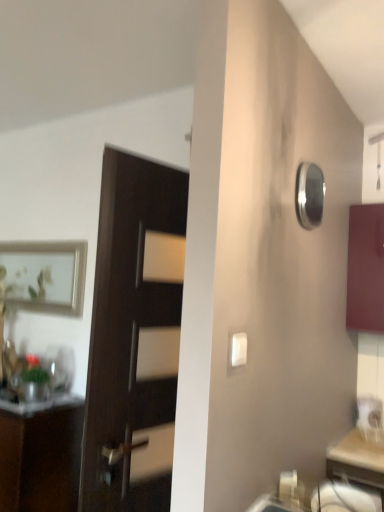
What do you see at coordinates (365, 268) in the screenshot? The height and width of the screenshot is (512, 384). I see `matte burgundy cabinet at right, which is the 2th cabinetry in bottom-to-top order` at bounding box center [365, 268].

Identify the location of white plastic light switch at center. (239, 349).

The image size is (384, 512). Identify the location of polished silver mirror at upper right. (309, 195).

At what (x,y) coordinates should I click in order to perform the action: click on dark wood door at center. Please return your answer as a coordinate pair (x, y). This screenshot has height=512, width=384. Looking at the image, I should click on (134, 336).

Between point (150, 211) and point (376, 275), which one is positioned behind?

The point (376, 275) is farther.

Is dark wood door at center looking in the opposite direction of matte burgundy cabinet at right, which appears as the 1th cabinetry when viewed from the top?

No, dark wood door at center's orientation is not away from matte burgundy cabinet at right, which appears as the 1th cabinetry when viewed from the top.

Is dark wood door at center smaller than matte burgundy cabinet at right, marked as the first cabinetry in a right-to-left arrangement?

Actually, dark wood door at center might be larger than matte burgundy cabinet at right, marked as the first cabinetry in a right-to-left arrangement.

How many degrees apart are the facing directions of matte brown cabinet at left, the first cabinetry from the left, and matte burgundy cabinet at right, which appears as the 1th cabinetry when viewed from the top?

The angle between the facing direction of matte brown cabinet at left, the first cabinetry from the left, and the facing direction of matte burgundy cabinet at right, which appears as the 1th cabinetry when viewed from the top, is 0.533 degrees.

From the image's perspective, is matte brown cabinet at left, the first cabinetry from the left, on top of matte burgundy cabinet at right, marked as the first cabinetry in a right-to-left arrangement?

No, from the image's perspective, matte brown cabinet at left, the first cabinetry from the left, is not above matte burgundy cabinet at right, marked as the first cabinetry in a right-to-left arrangement.

Could you measure the distance between matte brown cabinet at left, marked as the second cabinetry in a top-to-bottom arrangement, and matte burgundy cabinet at right, which appears as the 1th cabinetry when viewed from the top?

The distance of matte brown cabinet at left, marked as the second cabinetry in a top-to-bottom arrangement, from matte burgundy cabinet at right, which appears as the 1th cabinetry when viewed from the top, is 5.91 feet.

Considering the positions of objects matte brown cabinet at left, the first cabinetry from the left, and matte burgundy cabinet at right, the second cabinetry in the left-to-right sequence, in the image provided, who is more to the right, matte brown cabinet at left, the first cabinetry from the left, or matte burgundy cabinet at right, the second cabinetry in the left-to-right sequence,?

Positioned to the right is matte burgundy cabinet at right, the second cabinetry in the left-to-right sequence.

Is matte burgundy cabinet at right, the second cabinetry in the left-to-right sequence, at the left side of matte silver picture frame at upper left?

No.

Is matte burgundy cabinet at right, which is the 2th cabinetry in bottom-to-top order, positioned far away from matte silver picture frame at upper left?

Yes, matte burgundy cabinet at right, which is the 2th cabinetry in bottom-to-top order, is far from matte silver picture frame at upper left.

Is matte burgundy cabinet at right, which appears as the 1th cabinetry when viewed from the top, situated inside matte silver picture frame at upper left or outside?

matte burgundy cabinet at right, which appears as the 1th cabinetry when viewed from the top, is outside matte silver picture frame at upper left.

At what (x,y) coordinates should I click in order to perform the action: click on picture frame that is under the matte burgundy cabinet at right, which is the 2th cabinetry in bottom-to-top order (from a real-world perspective). Please return your answer as a coordinate pair (x, y). The width and height of the screenshot is (384, 512). Looking at the image, I should click on (45, 275).

Is matte silver picture frame at upper left thinner than polished silver mirror at upper right?

Indeed, matte silver picture frame at upper left has a lesser width compared to polished silver mirror at upper right.

Does matte silver picture frame at upper left appear on the right side of polished silver mirror at upper right?

No.

Does matte silver picture frame at upper left have a lesser height compared to polished silver mirror at upper right?

Incorrect, the height of matte silver picture frame at upper left does not fall short of that of polished silver mirror at upper right.

Considering the sizes of white plastic light switch at center and polished silver mirror at upper right in the image, is white plastic light switch at center taller or shorter than polished silver mirror at upper right?

Clearly, white plastic light switch at center is shorter compared to polished silver mirror at upper right.

Between white plastic light switch at center and polished silver mirror at upper right, which one is positioned in front?

white plastic light switch at center is in front.

From the image's perspective, is white plastic light switch at center below polished silver mirror at upper right?

Yes, from the image's perspective, white plastic light switch at center is beneath polished silver mirror at upper right.

Which object is closer to the camera taking this photo, matte silver picture frame at upper left or matte brown cabinet at left, marked as the second cabinetry in a top-to-bottom arrangement?

Positioned in front is matte brown cabinet at left, marked as the second cabinetry in a top-to-bottom arrangement.

Is matte silver picture frame at upper left with matte brown cabinet at left, marked as the second cabinetry in a top-to-bottom arrangement?

No, matte silver picture frame at upper left is not touching matte brown cabinet at left, marked as the second cabinetry in a top-to-bottom arrangement.

Between matte silver picture frame at upper left and matte brown cabinet at left, marked as the second cabinetry in a top-to-bottom arrangement, which one has larger size?

matte brown cabinet at left, marked as the second cabinetry in a top-to-bottom arrangement.

How different are the orientations of matte silver picture frame at upper left and matte brown cabinet at left, the first cabinetry from the left, in degrees?

The facing directions of matte silver picture frame at upper left and matte brown cabinet at left, the first cabinetry from the left, are 0.939 degrees apart.

Is point (237, 337) behind point (63, 452)?

No, it is in front of (63, 452).

Starting from the white plastic light switch at center, which cabinetry is the 1st one behind? Please provide its 2D coordinates.

[(41, 458)]

Does white plastic light switch at center turn towards matte brown cabinet at left, the first cabinetry from the left?

No, white plastic light switch at center is not oriented towards matte brown cabinet at left, the first cabinetry from the left.

Is white plastic light switch at center wider than matte brown cabinet at left, marked as the second cabinetry in a top-to-bottom arrangement?

In fact, white plastic light switch at center might be narrower than matte brown cabinet at left, marked as the second cabinetry in a top-to-bottom arrangement.

Image resolution: width=384 pixels, height=512 pixels. What are the coordinates of `cabinetry on the right of dark wood door at center` in the screenshot? It's located at (365, 268).

Image resolution: width=384 pixels, height=512 pixels. In order to click on cabinetry below the matte burgundy cabinet at right, marked as the first cabinetry in a right-to-left arrangement (from a real-world perspective) in this screenshot , I will do `click(41, 458)`.

When comparing their distances from dark wood door at center, does matte brown cabinet at left, positioned as the 1th cabinetry in bottom-to-top order, or matte white drawer at lower right seem further?

matte white drawer at lower right lies further to dark wood door at center than the other object.

Based on their spatial positions, is polished silver mirror at upper right or matte burgundy cabinet at right, the second cabinetry in the left-to-right sequence, further from matte brown cabinet at left, the first cabinetry from the left?

matte burgundy cabinet at right, the second cabinetry in the left-to-right sequence, is further to matte brown cabinet at left, the first cabinetry from the left.

In the scene shown: From the image, which object appears to be nearer to matte burgundy cabinet at right, which appears as the 1th cabinetry when viewed from the top, matte white drawer at lower right or white plastic light switch at center?

The object closer to matte burgundy cabinet at right, which appears as the 1th cabinetry when viewed from the top, is matte white drawer at lower right.

Considering their positions, is matte silver picture frame at upper left positioned closer to matte brown cabinet at left, which is the second cabinetry in right-to-left order, than matte burgundy cabinet at right, marked as the first cabinetry in a right-to-left arrangement?

matte silver picture frame at upper left is closer to matte brown cabinet at left, which is the second cabinetry in right-to-left order.

Looking at the image, which one is located further to white plastic light switch at center, matte silver picture frame at upper left or polished silver mirror at upper right?

matte silver picture frame at upper left is further to white plastic light switch at center.

Estimate the real-world distances between objects in this image. Which object is further from polished silver mirror at upper right, matte white drawer at lower right or white plastic light switch at center?

matte white drawer at lower right.

Considering their positions, is white plastic light switch at center positioned closer to dark wood door at center than matte brown cabinet at left, which is the second cabinetry in right-to-left order?

Among the two, white plastic light switch at center is located nearer to dark wood door at center.

Based on their spatial positions, is dark wood door at center or polished silver mirror at upper right closer to matte brown cabinet at left, which is the second cabinetry in right-to-left order?

dark wood door at center lies closer to matte brown cabinet at left, which is the second cabinetry in right-to-left order, than the other object.

Identify the location of picture frame situated between matte brown cabinet at left, the first cabinetry from the left, and white plastic light switch at center from left to right. (45, 275).

You are a GUI agent. You are given a task and a screenshot of the screen. Output one action in this format:
    pyautogui.click(x=<x>, y=<y>)
    Task: Click on the mirror between matte silver picture frame at upper left and matte burgundy cabinet at right, the second cabinetry in the left-to-right sequence
    
    Given the screenshot: What is the action you would take?
    pyautogui.click(x=309, y=195)

Find the location of a particular element. light switch situated between matte silver picture frame at upper left and matte burgundy cabinet at right, marked as the first cabinetry in a right-to-left arrangement, from left to right is located at coordinates (239, 349).

Identify the location of door between matte brown cabinet at left, marked as the second cabinetry in a top-to-bottom arrangement, and matte burgundy cabinet at right, the second cabinetry in the left-to-right sequence. Image resolution: width=384 pixels, height=512 pixels. tap(134, 336).